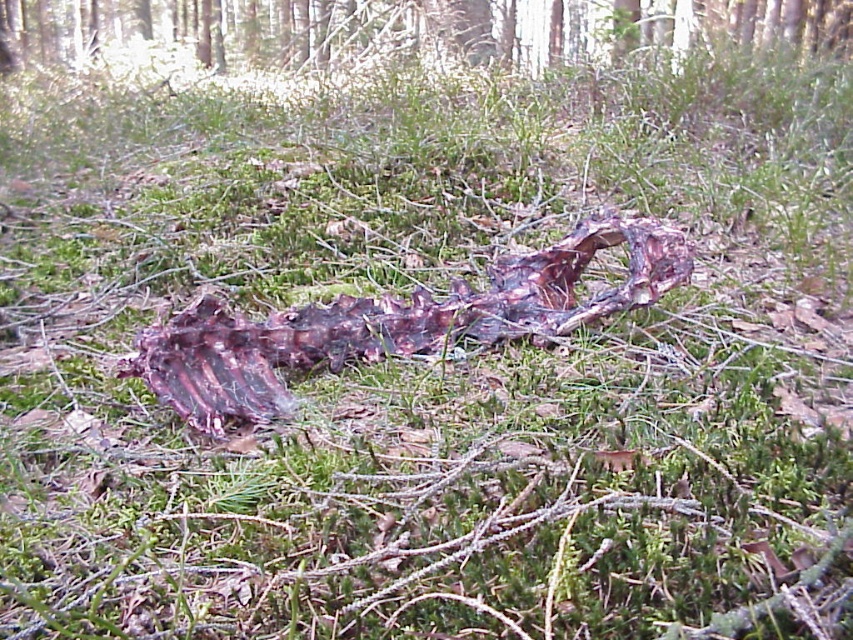
You are a forest ranger examining the scene. You notice the smooth bark tree at upper center and the rusty metallic ribcage at center. Which object is closer to you?

The smooth bark tree at upper center is closer to you because it is in front of the rusty metallic ribcage at center.

You are a hiker who has stumbled upon this forest scene. You need to determine the relative sizes of the smooth bark tree at upper center and the rusty metallic ribcage at center. Which object is wider?

The smooth bark tree at upper center is wider than the rusty metallic ribcage at center according to the description provided.

You are a hiker who has stumbled upon this forest scene. You notice the smooth bark tree at upper center and the rusty metallic ribcage at center. Which object is taller?

The smooth bark tree at upper center is taller than the rusty metallic ribcage at center.